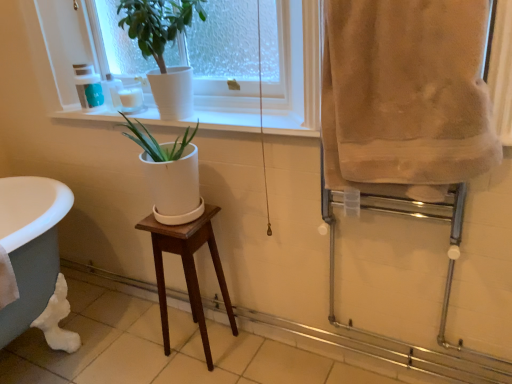
Identify the location of vacant space underneath mahogany wood stool at center (from a real-world perspective). (201, 350).